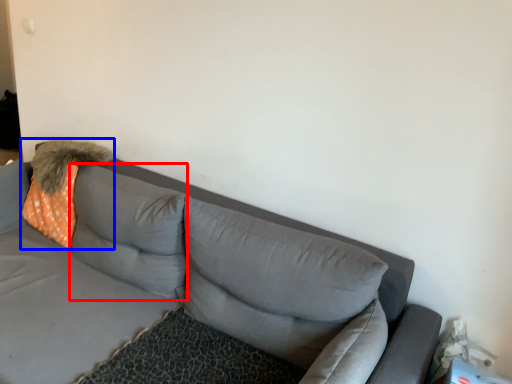
Question: Which object is further to the camera taking this photo, pillow (highlighted by a red box) or throw pillow (highlighted by a blue box)?

Choices:
 (A) pillow
 (B) throw pillow

Answer: (B)